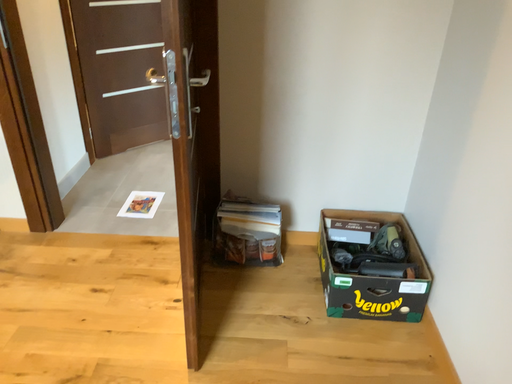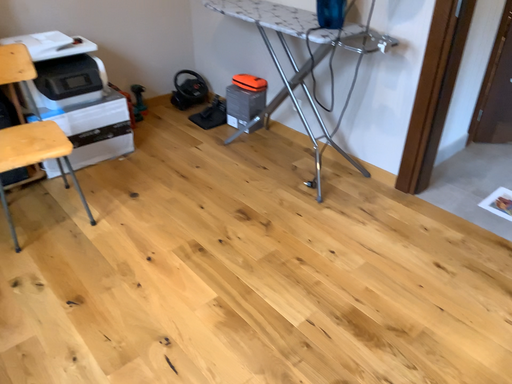
Question: How did the camera likely rotate when shooting the video?

Choices:
 (A) rotated downward
 (B) rotated upward

Answer: (B)